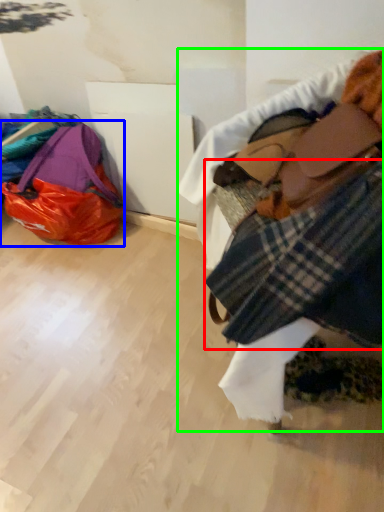
Question: Which object is positioned farthest from flannel (highlighted by a red box)? Select from luggage and bags (highlighted by a blue box) and textile (highlighted by a green box).

Choices:
 (A) luggage and bags
 (B) textile

Answer: (A)